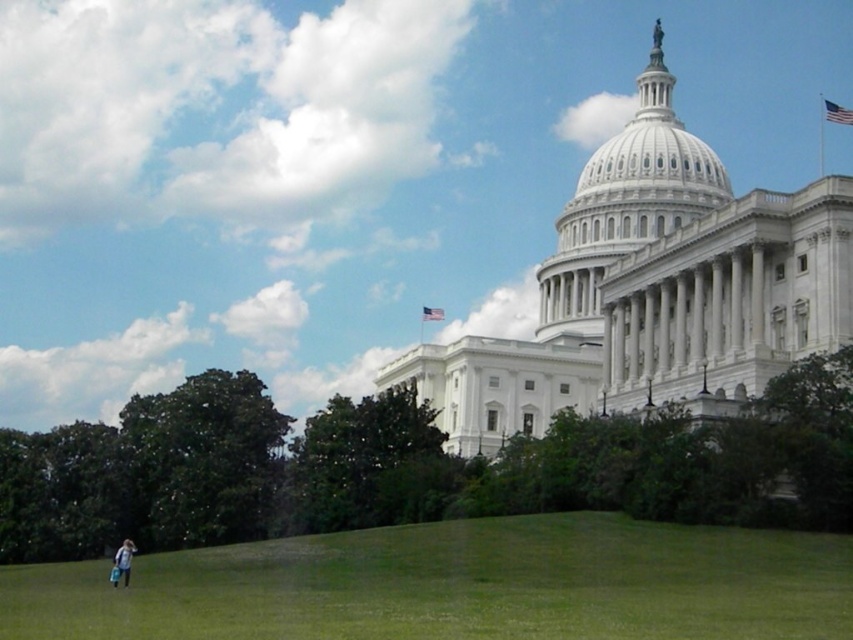
Question: Is green grassy hill at lower left wider than light blue denim jacket at lower left?

Choices:
 (A) yes
 (B) no

Answer: (A)

Question: Is green grassy hill at lower left to the right of light blue denim jacket at lower left from the viewer's perspective?

Choices:
 (A) yes
 (B) no

Answer: (A)

Question: Which object is farther from the camera taking this photo?

Choices:
 (A) green grassy hill at lower left
 (B) light blue denim jacket at lower left

Answer: (B)

Question: Does green grassy hill at lower left appear on the right side of light blue denim jacket at lower left?

Choices:
 (A) no
 (B) yes

Answer: (B)